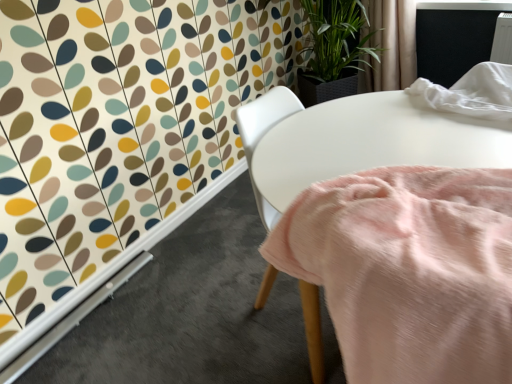
Question: Should I look upward or downward to see beige fabric curtain at upper right?

Choices:
 (A) down
 (B) up

Answer: (B)

Question: Is pink soft fabric at center shorter than beige fabric curtain at upper right?

Choices:
 (A) yes
 (B) no

Answer: (B)

Question: Is pink soft fabric at center turned away from beige fabric curtain at upper right?

Choices:
 (A) no
 (B) yes

Answer: (A)

Question: From a real-world perspective, does pink soft fabric at center stand above beige fabric curtain at upper right?

Choices:
 (A) yes
 (B) no

Answer: (B)

Question: From a real-world perspective, is pink soft fabric at center physically below beige fabric curtain at upper right?

Choices:
 (A) yes
 (B) no

Answer: (A)

Question: Is pink soft fabric at center to the right of beige fabric curtain at upper right from the viewer's perspective?

Choices:
 (A) no
 (B) yes

Answer: (A)

Question: Considering the relative sizes of pink soft fabric at center and beige fabric curtain at upper right in the image provided, is pink soft fabric at center thinner than beige fabric curtain at upper right?

Choices:
 (A) no
 (B) yes

Answer: (A)

Question: Can you confirm if beige fabric curtain at upper right is taller than pink soft fabric at center?

Choices:
 (A) no
 (B) yes

Answer: (A)

Question: From a real-world perspective, is beige fabric curtain at upper right below pink soft fabric at center?

Choices:
 (A) no
 (B) yes

Answer: (A)

Question: Is beige fabric curtain at upper right far away from pink soft fabric at center?

Choices:
 (A) yes
 (B) no

Answer: (A)

Question: Considering the relative sizes of beige fabric curtain at upper right and pink soft fabric at center in the image provided, is beige fabric curtain at upper right shorter than pink soft fabric at center?

Choices:
 (A) yes
 (B) no

Answer: (A)

Question: From the image's perspective, is beige fabric curtain at upper right beneath pink soft fabric at center?

Choices:
 (A) yes
 (B) no

Answer: (B)

Question: Is beige fabric curtain at upper right at the left side of pink soft fabric at center?

Choices:
 (A) no
 (B) yes

Answer: (A)

Question: Considering the positions of beige fabric curtain at upper right and pink soft fabric at center in the image, is beige fabric curtain at upper right bigger or smaller than pink soft fabric at center?

Choices:
 (A) big
 (B) small

Answer: (B)